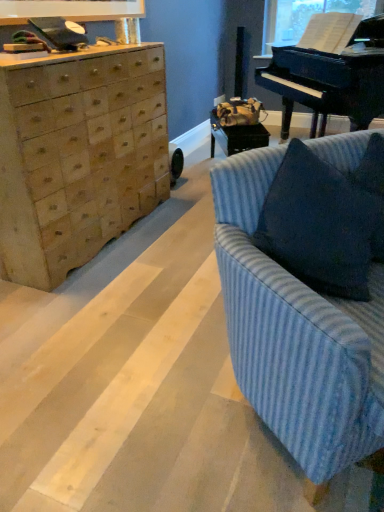
Question: Is point (334, 210) positioned closer to the camera than point (349, 91)?

Choices:
 (A) closer
 (B) farther

Answer: (A)

Question: Considering their positions, is blue textured pillow at right located in front of or behind black polished piano at upper right?

Choices:
 (A) behind
 (B) front

Answer: (B)

Question: Based on their relative distances, which object is farther from the transparent plastic window screen at upper right?

Choices:
 (A) natural wood chest of drawers at left
 (B) blue textured pillow at right
 (C) black polished piano at upper right
 (D) blue striped fabric couch at right

Answer: (D)

Question: Which is nearer to the blue striped fabric couch at right?

Choices:
 (A) blue textured pillow at right
 (B) black polished piano at upper right
 (C) transparent plastic window screen at upper right
 (D) natural wood chest of drawers at left

Answer: (A)